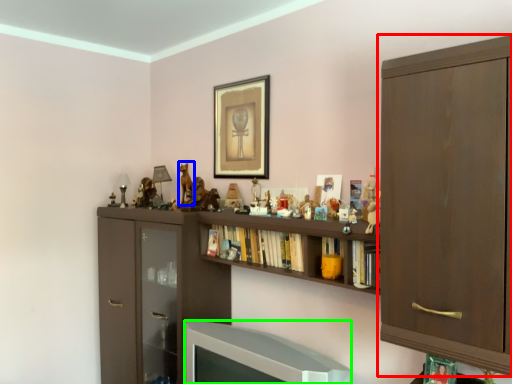
Question: Based on their relative distances, which object is farther from cabinetry (highlighted by a red box)? Choose from animal (highlighted by a blue box) and television (highlighted by a green box).

Choices:
 (A) animal
 (B) television

Answer: (A)